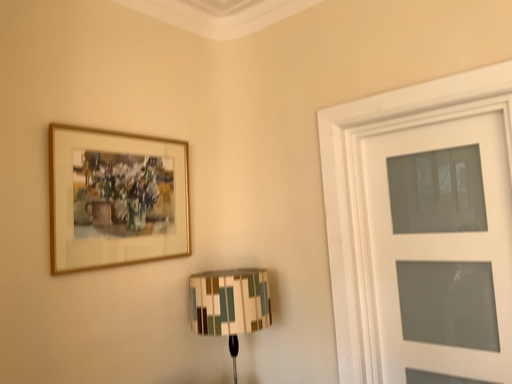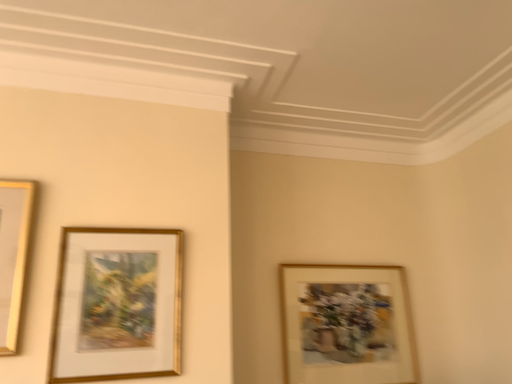
Question: Which way did the camera rotate in the video?

Choices:
 (A) rotated downward
 (B) rotated upward

Answer: (B)